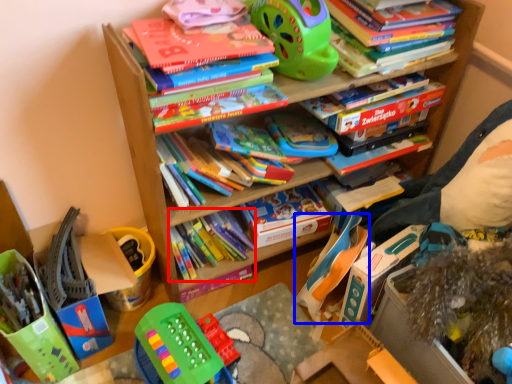
Question: Which point is closer to the camera, book (highlighted by a red box) or toy (highlighted by a blue box)?

Choices:
 (A) book
 (B) toy

Answer: (B)